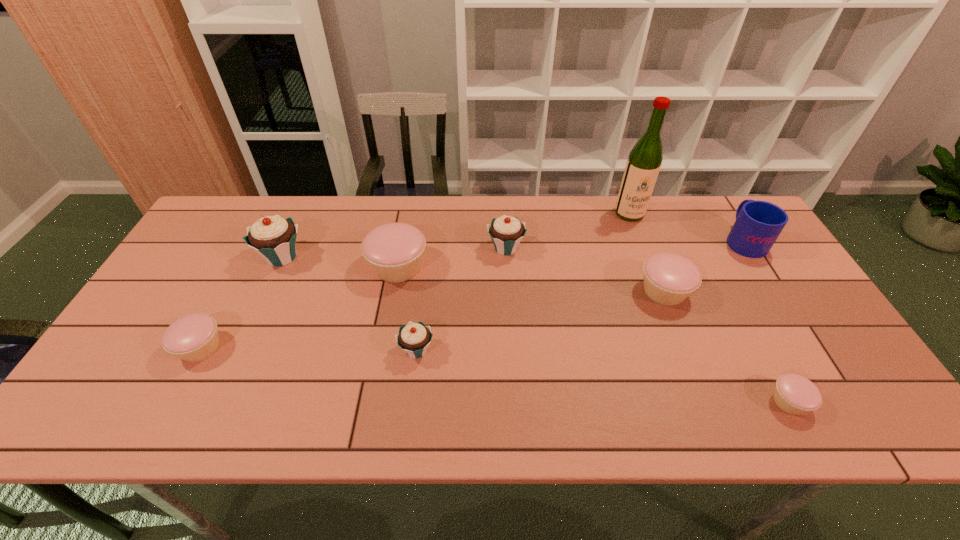
Where is `mug at the right edge`? The height and width of the screenshot is (540, 960). mug at the right edge is located at coordinates (758, 224).

The width and height of the screenshot is (960, 540). Find the location of `cupcake present at the right edge`. cupcake present at the right edge is located at coordinates (794, 394).

The image size is (960, 540). In order to click on object at the far right corner in this screenshot , I will do `click(758, 224)`.

This screenshot has width=960, height=540. I want to click on object at the near right corner, so click(x=794, y=394).

In the image, there is a desktop. Where is `vacant space at the far edge`? Image resolution: width=960 pixels, height=540 pixels. vacant space at the far edge is located at coordinates (376, 225).

This screenshot has width=960, height=540. In the image, there is a desktop. In order to click on vacant region at the near edge in this screenshot , I will do `click(359, 431)`.

The width and height of the screenshot is (960, 540). I want to click on vacant space at the left edge, so click(207, 274).

I want to click on vacant space at the right edge of the desktop, so click(x=749, y=307).

Locate an element on the screen. The image size is (960, 540). free region at the far right corner of the desktop is located at coordinates (x=730, y=198).

The height and width of the screenshot is (540, 960). I want to click on free space between the biggest pink cupcake and the smallest pink cupcake, so click(593, 334).